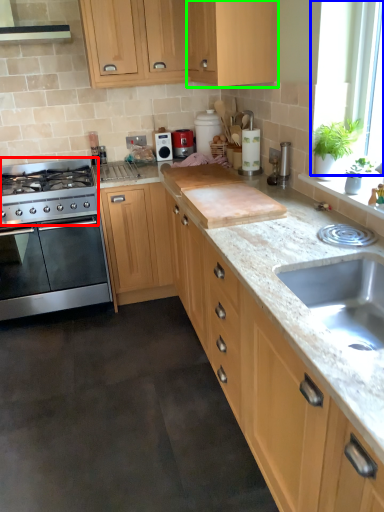
Question: Considering the real-world distances, which object is farthest from gas stove (highlighted by a red box)? window screen (highlighted by a blue box) or cabinetry (highlighted by a green box)?

Choices:
 (A) window screen
 (B) cabinetry

Answer: (A)